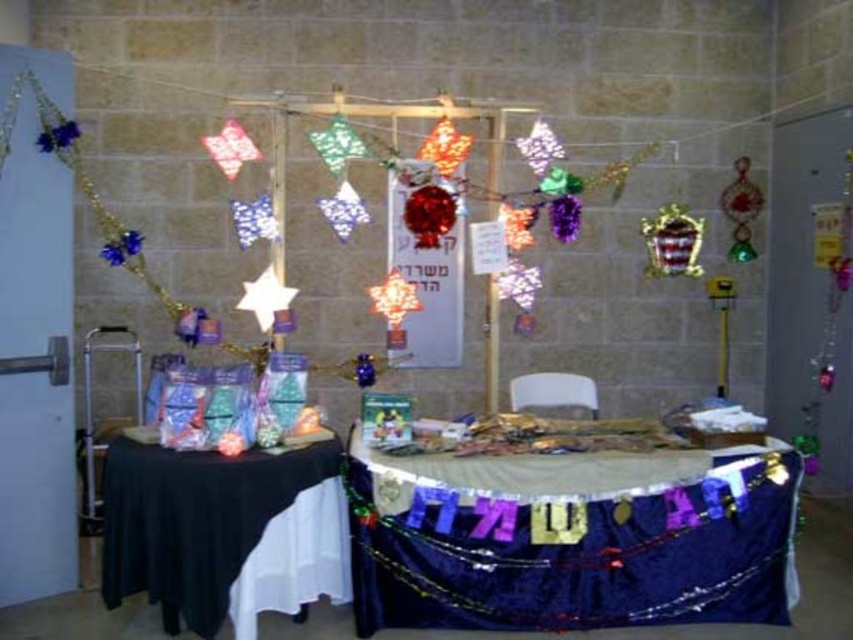
Question: Does shiny blue tablecloth at center appear over black fabric table at lower left?

Choices:
 (A) yes
 (B) no

Answer: (B)

Question: Which point is closer to the camera?

Choices:
 (A) shiny blue tablecloth at center
 (B) black fabric table at lower left

Answer: (B)

Question: Which of the following is the closest to the observer?

Choices:
 (A) [x=242, y=500]
 (B) [x=547, y=611]

Answer: (A)

Question: Is shiny blue tablecloth at center behind black fabric table at lower left?

Choices:
 (A) yes
 (B) no

Answer: (A)

Question: Is shiny blue tablecloth at center behind black fabric table at lower left?

Choices:
 (A) no
 (B) yes

Answer: (B)